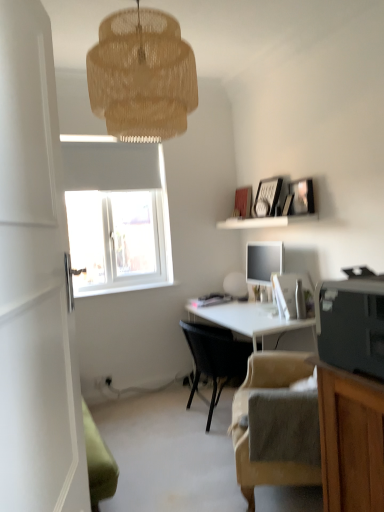
This screenshot has width=384, height=512. What are the coordinates of `free spot below black woven chair at center, the second chair positioned from the front (from a real-world perspective)` in the screenshot? It's located at (211, 418).